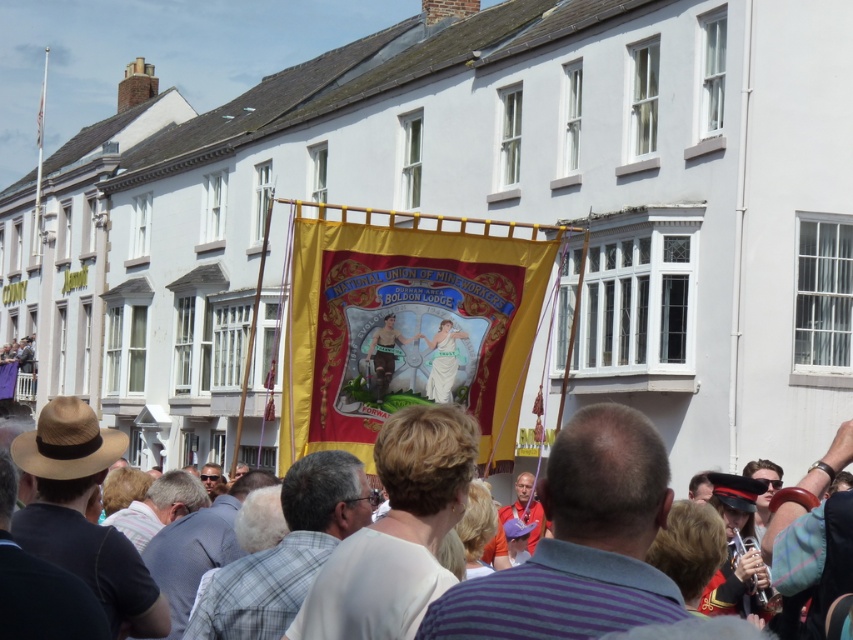
Question: Can you confirm if red velvet banner at center is smaller than matte brown leather boots at center?

Choices:
 (A) no
 (B) yes

Answer: (A)

Question: Which object appears farthest from the camera in this image?

Choices:
 (A) yellow fabric banner at center
 (B) red velvet banner at center
 (C) white fabric at center

Answer: (A)

Question: Is red velvet banner at center above white fabric at center?

Choices:
 (A) yes
 (B) no

Answer: (A)

Question: Based on their relative distances, which object is farther from the red velvet banner at center?

Choices:
 (A) white fabric at center
 (B) matte brown leather boots at center
 (C) yellow fabric banner at center

Answer: (C)

Question: Among these objects, which one is farthest from the camera?

Choices:
 (A) matte brown leather boots at center
 (B) red velvet banner at center
 (C) white fabric at center
 (D) yellow fabric banner at center

Answer: (D)

Question: Does red velvet banner at center have a larger size compared to matte brown leather boots at center?

Choices:
 (A) yes
 (B) no

Answer: (A)